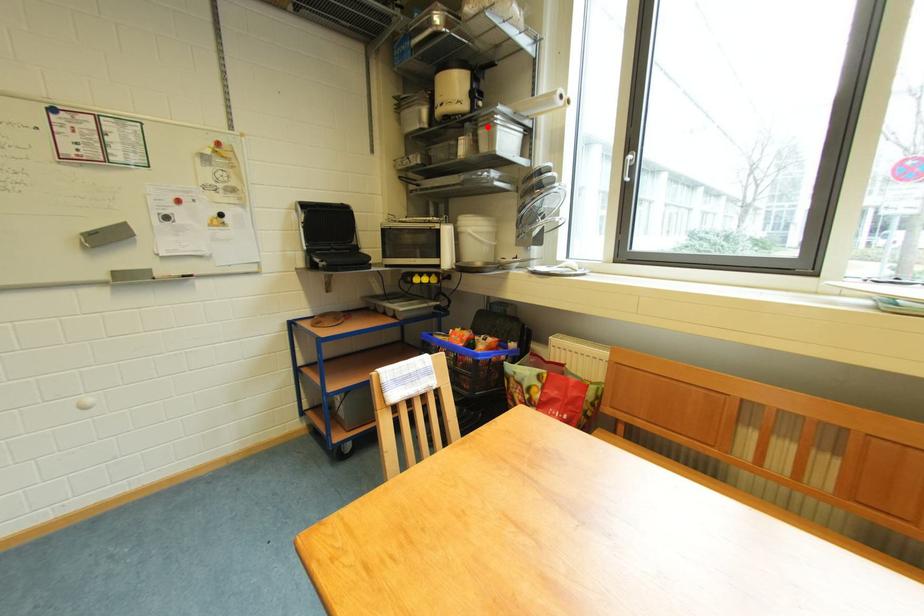
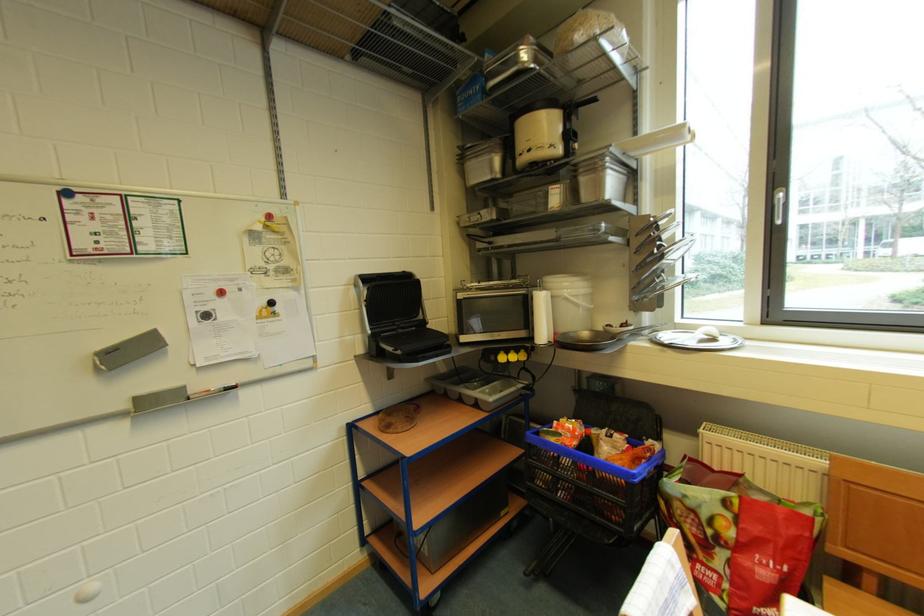
Find the pixel in the second image that matches the highlighted location in the first image.

(589, 174)